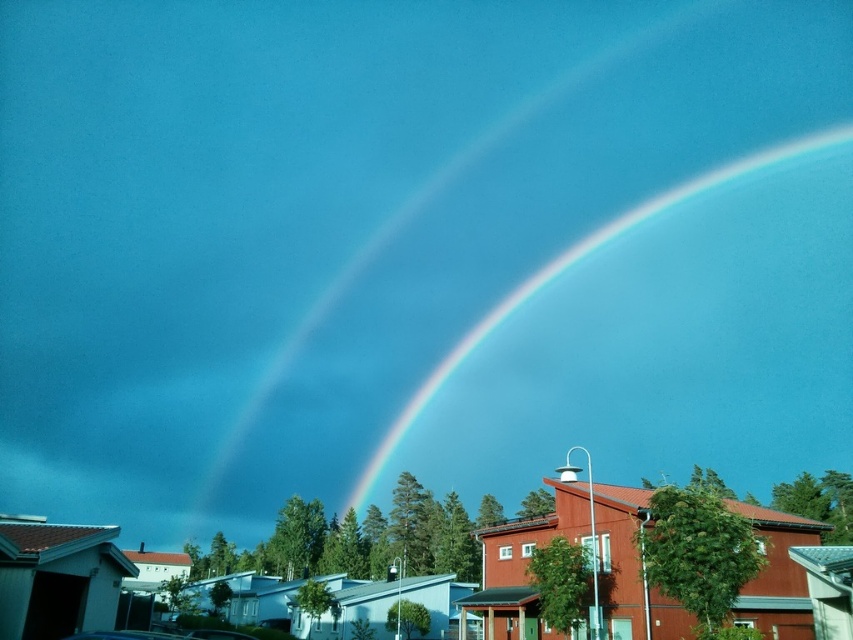
You are a photographer trying to capture the rainbow at upper center and the metallic silver car at lower center in a single frame. Based on their sizes, which object would likely occupy more of the photo frame?

The rainbow at upper center is wider than the metallic silver car at lower center, so it would occupy more of the photo frame.

You are standing at the point marked as point [566,269] in the image. What object is located exactly at that point?

The point [566,269] is exactly where the rainbow at upper center is located.